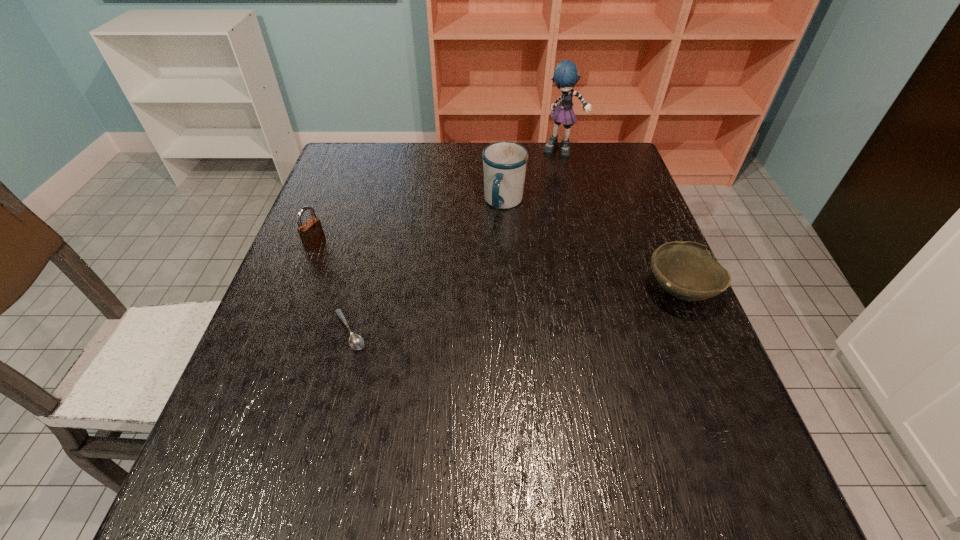
I want to click on the shortest object, so click(356, 342).

I want to click on the fourth object from right to left, so click(x=356, y=342).

Where is `the rightmost object`? This screenshot has width=960, height=540. the rightmost object is located at coordinates (686, 270).

I want to click on bowl, so click(686, 270).

Identify the location of mug. (504, 163).

What are the coordinates of `the third object from left to right` in the screenshot? It's located at (504, 163).

I want to click on the leftmost object, so click(x=311, y=232).

Where is `the third tallest object`? The image size is (960, 540). the third tallest object is located at coordinates (311, 232).

Locate an element on the screen. rag doll is located at coordinates (565, 76).

Identify the location of the fourth object from left to right. (565, 76).